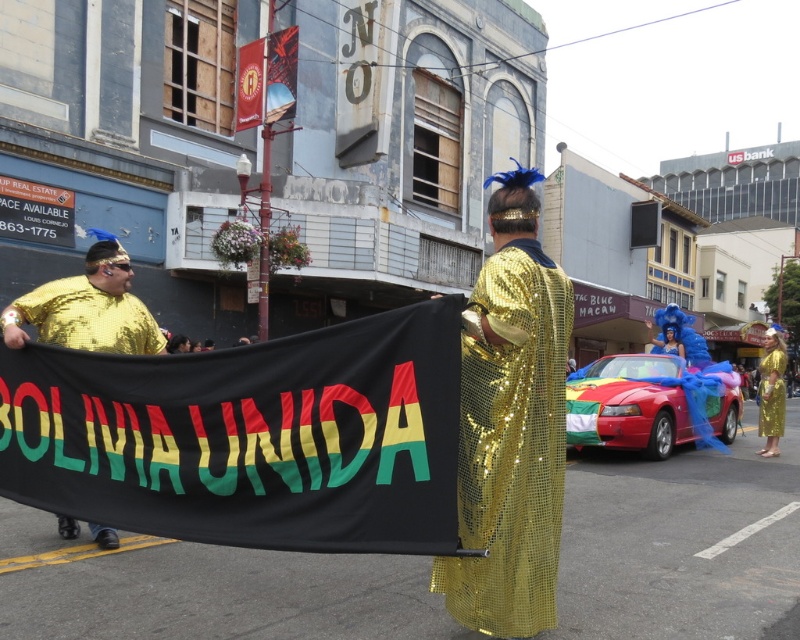
Based on the photo, is black fabric banner at center above gold sequined shirt at left?

Incorrect, black fabric banner at center is not positioned above gold sequined shirt at left.

Who is positioned more to the right, black fabric banner at center or gold sequined shirt at left?

From the viewer's perspective, black fabric banner at center appears more on the right side.

Between point (142, 440) and point (134, 336), which one is positioned behind?

The point (134, 336) is more distant.

The height and width of the screenshot is (640, 800). In order to click on black fabric banner at center in this screenshot , I will do `click(249, 436)`.

Can you confirm if black fabric banner at center is positioned to the left of gold sequined dress at center?

Indeed, black fabric banner at center is positioned on the left side of gold sequined dress at center.

Is black fabric banner at center below gold sequined dress at center?

No, black fabric banner at center is not below gold sequined dress at center.

Is point (82, 442) positioned behind point (782, 342)?

No, (82, 442) is in front of (782, 342).

Where is `black fabric banner at center`? black fabric banner at center is located at coordinates (249, 436).

Is gold sequined shirt at left below gold sequined dress at center?

No, gold sequined shirt at left is not below gold sequined dress at center.

Does gold sequined shirt at left have a lesser width compared to gold sequined dress at center?

Yes.

Is point (58, 294) more distant than point (774, 348)?

No, (58, 294) is closer to viewer.

I want to click on gold sequined shirt at left, so click(88, 307).